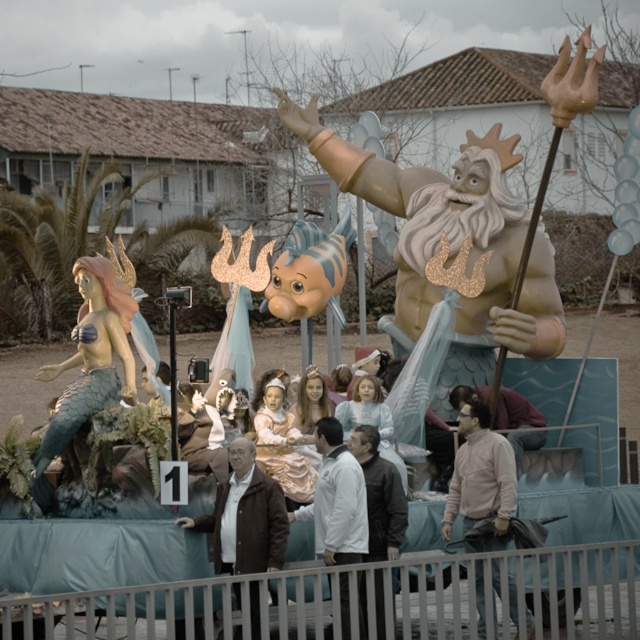
Question: Which point is farther from the camera taking this photo?

Choices:
 (A) (456, 509)
 (B) (260, 428)

Answer: (B)

Question: Is light pink fabric jacket at center to the right of pastel pink fabric at center from the viewer's perspective?

Choices:
 (A) no
 (B) yes

Answer: (B)

Question: Is gold metallic trident at upper center above light brown leather jacket at center?

Choices:
 (A) no
 (B) yes

Answer: (B)

Question: Which point is closer to the camera?

Choices:
 (A) (496, 588)
 (B) (262, 520)

Answer: (B)

Question: Can you confirm if light brown leather jacket at center is positioned to the right of pastel pink fabric at center?

Choices:
 (A) no
 (B) yes

Answer: (B)

Question: Which point appears closest to the camera in this image?

Choices:
 (A) (300, 125)
 (B) (364, 580)
 (C) (296, 433)
 (D) (228, 561)

Answer: (B)